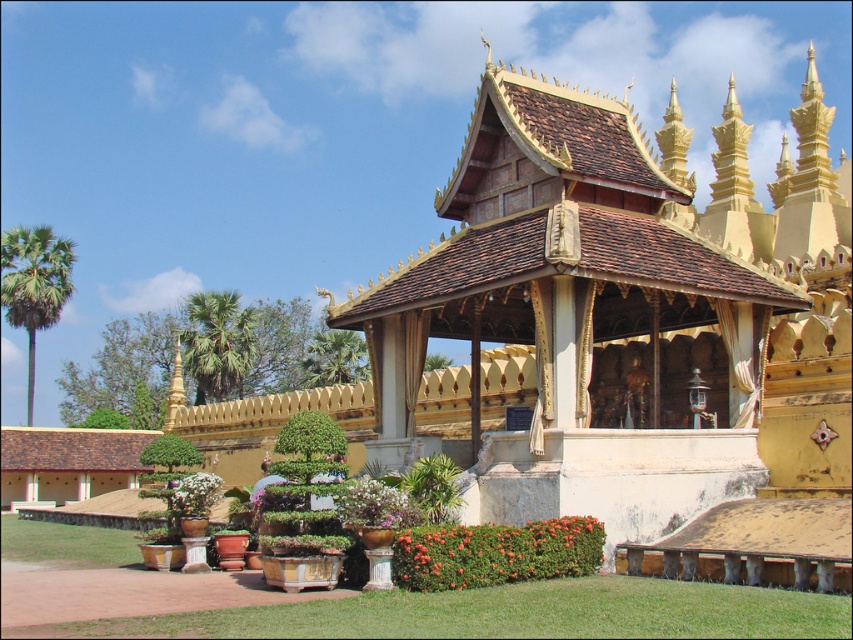
Question: Is green leafy plant at center to the left of white matte flower pot at lower center from the viewer's perspective?

Choices:
 (A) no
 (B) yes

Answer: (A)

Question: Considering the relative positions of golden wood gazebo at center and green leafy bush at lower center in the image provided, where is golden wood gazebo at center located with respect to green leafy bush at lower center?

Choices:
 (A) left
 (B) right

Answer: (B)

Question: From the image, what is the correct spatial relationship of green leafy plant at center in relation to white matte flowers at center?

Choices:
 (A) above
 (B) below

Answer: (B)

Question: Which object is closer to the camera taking this photo?

Choices:
 (A) white matte flowers at center
 (B) white matte flower pot at lower center
 (C) green leafy plant at center
 (D) golden wood gazebo at center

Answer: (A)

Question: Among these objects, which one is farthest from the camera?

Choices:
 (A) white matte flower pot at lower center
 (B) green leafy bush at lower center
 (C) golden wood gazebo at center
 (D) green leafy plant at center

Answer: (A)

Question: Which object is the closest to the green leafy bush at lower center?

Choices:
 (A) golden wood gazebo at center
 (B) white matte flowers at center

Answer: (B)